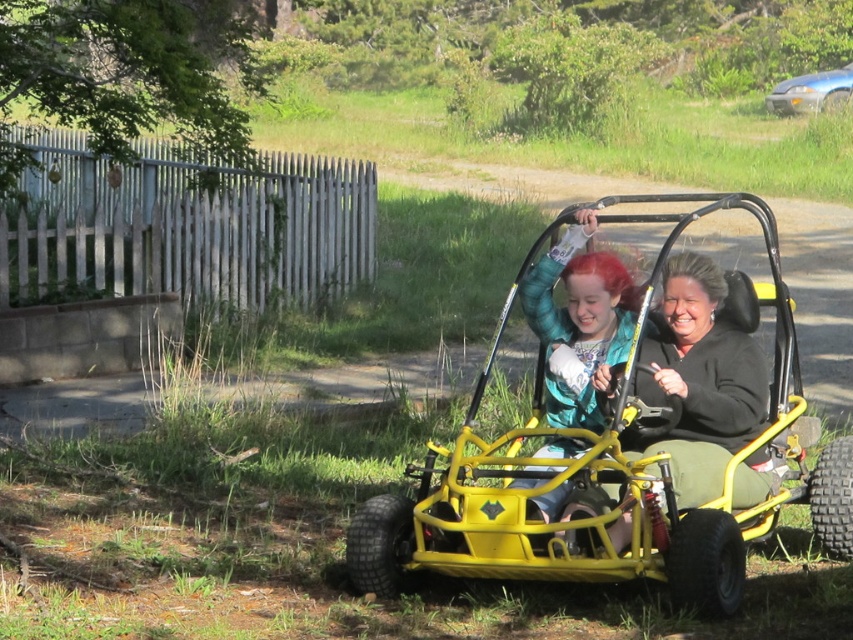
Which of these two, yellow matte go-kart at center or matte black jacket at center, stands shorter?

matte black jacket at center

Does point (550, 452) come closer to viewer compared to point (723, 362)?

Yes, it is in front of point (723, 362).

In order to click on yellow matte go-kart at center in this screenshot , I will do `click(625, 440)`.

At what (x,y) coordinates should I click in order to perform the action: click on yellow matte go-kart at center. Please return your answer as a coordinate pair (x, y). The image size is (853, 640). Looking at the image, I should click on (625, 440).

Is matte black jacket at center to the left of metallic blue sedan at upper right from the viewer's perspective?

Yes, matte black jacket at center is to the left of metallic blue sedan at upper right.

Is point (759, 422) positioned before point (776, 84)?

Yes, point (759, 422) is closer to viewer.

Locate an element on the screen. matte black jacket at center is located at coordinates (701, 380).

Identify the location of matte black jacket at center. This screenshot has width=853, height=640. (701, 380).

Who is shorter, shiny teal jacket at center or metallic blue sedan at upper right?

Standing shorter between the two is shiny teal jacket at center.

Is shiny teal jacket at center thinner than metallic blue sedan at upper right?

Correct, shiny teal jacket at center's width is less than metallic blue sedan at upper right's.

Between point (595, 276) and point (791, 104), which one is positioned in front?

Positioned in front is point (595, 276).

I want to click on shiny teal jacket at center, so click(578, 323).